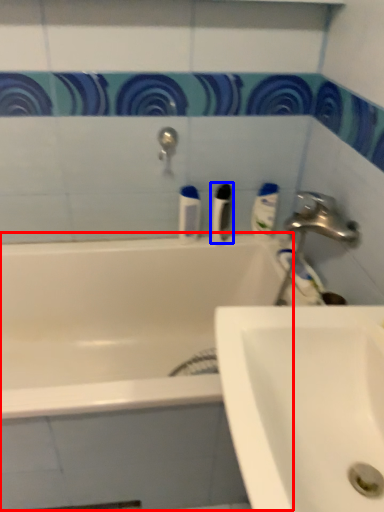
Question: Which of the following is the farthest to the observer, bath (highlighted by a red box) or toiletry (highlighted by a blue box)?

Choices:
 (A) bath
 (B) toiletry

Answer: (B)